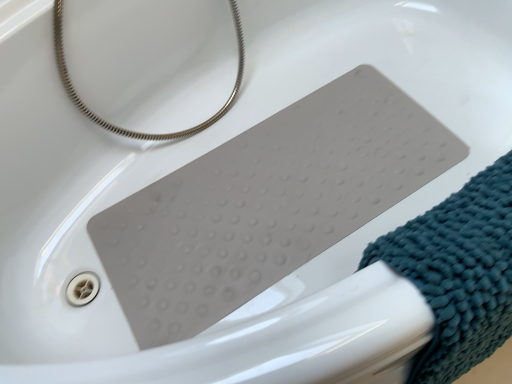
Describe the element at coordinates (458, 272) in the screenshot. The height and width of the screenshot is (384, 512). I see `teal textured towel at lower right` at that location.

Measure the distance between point (444,273) and camera.

A distance of 41.50 centimeters exists between point (444,273) and camera.

The width and height of the screenshot is (512, 384). Find the location of `teal textured towel at lower right`. teal textured towel at lower right is located at coordinates (458, 272).

Describe the element at coordinates (135, 131) in the screenshot. The width and height of the screenshot is (512, 384). I see `silver metallic hose at upper left` at that location.

At what (x,y) coordinates should I click in order to perform the action: click on silver metallic hose at upper left. Please return your answer as a coordinate pair (x, y). Looking at the image, I should click on (135, 131).

I want to click on teal textured towel at lower right, so click(458, 272).

From the picture: Considering the relative positions of silver metallic hose at upper left and teal textured towel at lower right in the image provided, is silver metallic hose at upper left to the right of teal textured towel at lower right from the viewer's perspective?

In fact, silver metallic hose at upper left is to the left of teal textured towel at lower right.

Which object is closer to the camera taking this photo, silver metallic hose at upper left or teal textured towel at lower right?

teal textured towel at lower right is in front.

Is point (56, 19) positioned behind point (467, 220)?

That is True.

From the image's perspective, is silver metallic hose at upper left above or below teal textured towel at lower right?

Clearly, from the image's perspective, silver metallic hose at upper left is above teal textured towel at lower right.

From a real-world perspective, is silver metallic hose at upper left physically above teal textured towel at lower right?

Yes, from a real-world perspective, silver metallic hose at upper left is above teal textured towel at lower right.

Which object is thinner, silver metallic hose at upper left or teal textured towel at lower right?

Thinner between the two is teal textured towel at lower right.

In terms of height, does silver metallic hose at upper left look taller or shorter compared to teal textured towel at lower right?

In the image, silver metallic hose at upper left appears to be taller than teal textured towel at lower right.

Is silver metallic hose at upper left bigger than teal textured towel at lower right?

Yes.

Is silver metallic hose at upper left spatially inside teal textured towel at lower right, or outside of it?

silver metallic hose at upper left exists outside the volume of teal textured towel at lower right.

Are silver metallic hose at upper left and teal textured towel at lower right beside each other?

silver metallic hose at upper left and teal textured towel at lower right are clearly separated.

From the picture: Is silver metallic hose at upper left positioned with its back to teal textured towel at lower right?

No, silver metallic hose at upper left's orientation is not away from teal textured towel at lower right.

How different are the orientations of silver metallic hose at upper left and teal textured towel at lower right in degrees?

There is a 25-degree angle between the facing directions of silver metallic hose at upper left and teal textured towel at lower right.

Measure the distance from silver metallic hose at upper left to teal textured towel at lower right.

30.15 inches.

Where is `string that is behind the teal textured towel at lower right`? Image resolution: width=512 pixels, height=384 pixels. string that is behind the teal textured towel at lower right is located at coordinates (135, 131).

Between teal textured towel at lower right and silver metallic hose at upper left, which one appears on the right side from the viewer's perspective?

From the viewer's perspective, teal textured towel at lower right appears more on the right side.

Relative to silver metallic hose at upper left, is teal textured towel at lower right in front or behind?

In the image, teal textured towel at lower right appears in front of silver metallic hose at upper left.

Considering the points (489, 225) and (132, 134), which point is behind, point (489, 225) or point (132, 134)?

The point (132, 134) is farther from the camera.

From the image's perspective, which object appears higher, teal textured towel at lower right or silver metallic hose at upper left?

From the image's view, silver metallic hose at upper left is above.

From a real-world perspective, which object stands above the other?

silver metallic hose at upper left, from a real-world perspective.

Based on the photo, does teal textured towel at lower right have a greater width compared to silver metallic hose at upper left?

In fact, teal textured towel at lower right might be narrower than silver metallic hose at upper left.

Is teal textured towel at lower right taller or shorter than silver metallic hose at upper left?

teal textured towel at lower right is shorter than silver metallic hose at upper left.

Considering the relative sizes of teal textured towel at lower right and silver metallic hose at upper left in the image provided, is teal textured towel at lower right bigger than silver metallic hose at upper left?

No.

Is teal textured towel at lower right located outside silver metallic hose at upper left?

teal textured towel at lower right lies outside silver metallic hose at upper left's area.

Would you say teal textured towel at lower right is a long distance from silver metallic hose at upper left?

No, there isn't a large distance between teal textured towel at lower right and silver metallic hose at upper left.

Could you tell me if teal textured towel at lower right is turned towards silver metallic hose at upper left?

No, teal textured towel at lower right is not aimed at silver metallic hose at upper left.

I want to click on string lying behind the teal textured towel at lower right, so click(135, 131).

Where is `wrap below the silver metallic hose at upper left (from the image's perspective)`? wrap below the silver metallic hose at upper left (from the image's perspective) is located at coordinates (458, 272).

This screenshot has width=512, height=384. I want to click on string behind the teal textured towel at lower right, so click(x=135, y=131).